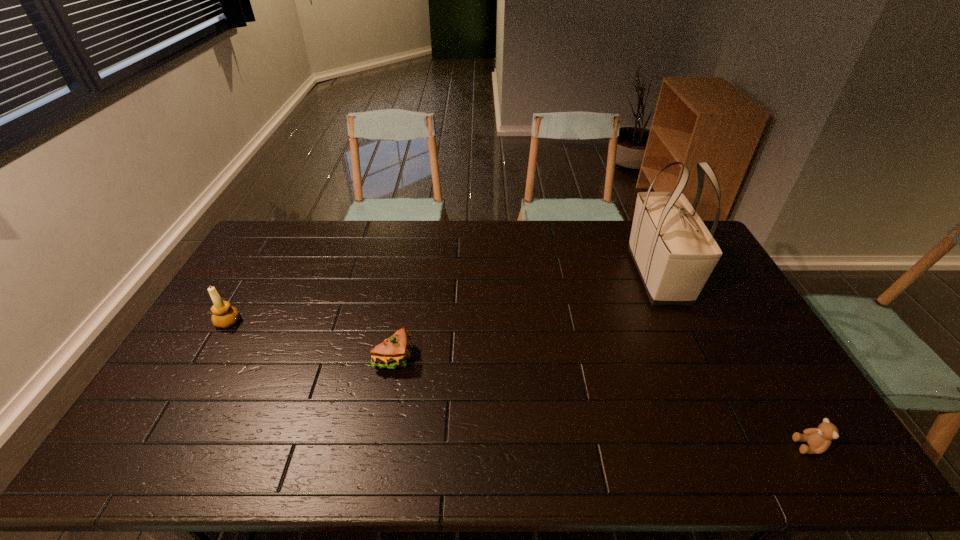
Locate an element on the screen. Image resolution: width=960 pixels, height=540 pixels. free point between the nearest object and the candle_holder is located at coordinates (519, 384).

The width and height of the screenshot is (960, 540). I want to click on free space between the third object from left to right and the third farthest object, so pyautogui.click(x=526, y=317).

At what (x,y) coordinates should I click in order to perform the action: click on vacant region between the rightmost object and the candle_holder. Please return your answer as a coordinate pair (x, y). The image size is (960, 540). Looking at the image, I should click on (519, 384).

Identify the location of blank region between the second tallest object and the shortest object. This screenshot has width=960, height=540. (519, 384).

Locate an element on the screen. vacant area that lies between the tallest object and the shortest object is located at coordinates (733, 361).

Find the location of a particular element. the closest object to the leftmost object is located at coordinates (392, 353).

At what (x,y) coordinates should I click in order to perform the action: click on object that stands as the second closest to the tallest object. Please return your answer as a coordinate pair (x, y). Looking at the image, I should click on (392, 353).